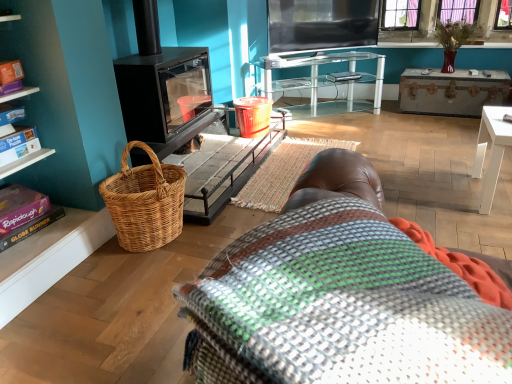
In order to face black matte fireplace at left, should I rotate leftwards or rightwards?

To face it directly, rotate left by 11.425 degrees.

This screenshot has width=512, height=384. I want to click on woven wicker basket at left, so click(x=145, y=201).

Measure the distance between multicolored woven blanket at center and camera.

multicolored woven blanket at center and camera are 7.89 feet apart from each other.

The image size is (512, 384). Identify the location of flat-screen tv at upper center. (321, 25).

In order to face flat-screen tv at upper center, should I rotate leftwards or rightwards?

Turn right approximately 8.965 degrees to face it.

Describe the element at coordinates (490, 151) in the screenshot. The width and height of the screenshot is (512, 384). I see `white glossy table at lower right, the 1th table when ordered from bottom to top` at that location.

Locate an element on the screen. rustic wooden trunk at upper right is located at coordinates (451, 92).

Locate an element on the screen. blanket located above the woven wicker basket at left (from the image's perspective) is located at coordinates (283, 172).

Can you tell me how much multicolored woven blanket at center and woven wicker basket at left differ in facing direction?

0.00218 degrees separate the facing orientations of multicolored woven blanket at center and woven wicker basket at left.

Is multicolored woven blanket at center closer to camera compared to woven wicker basket at left?

No, multicolored woven blanket at center is further to the viewer.

Is multicolored woven blanket at center facing away from woven wicker basket at left?

No, multicolored woven blanket at center's orientation is not away from woven wicker basket at left.

From the image's perspective, is purple matte book at lower left positioned above or below teal painted wood shelf at left?

Based on their image positions, purple matte book at lower left is located beneath teal painted wood shelf at left.

Which of these two, purple matte book at lower left or teal painted wood shelf at left, is thinner?

Thinner between the two is purple matte book at lower left.

Between purple matte book at lower left and teal painted wood shelf at left, which one has larger size?

teal painted wood shelf at left is bigger.

Considering the positions of objects purple matte book at lower left and teal painted wood shelf at left in the image provided, who is more to the left, purple matte book at lower left or teal painted wood shelf at left?

teal painted wood shelf at left.

Are purple matte book at lower left and white glossy table at lower right, arranged as the first table when viewed from the right, located far from each other?

That's right, there is a large distance between purple matte book at lower left and white glossy table at lower right, arranged as the first table when viewed from the right.

Is purple matte book at lower left completely or partially outside of white glossy table at lower right, which is the 2th table from top to bottom?

purple matte book at lower left is positioned outside white glossy table at lower right, which is the 2th table from top to bottom.

Which of these two, purple matte book at lower left or white glossy table at lower right, arranged as the first table when viewed from the right, is thinner?

With smaller width is purple matte book at lower left.

Would you say purple matte book at lower left is to the left or to the right of white glossy table at lower right, arranged as the first table when viewed from the right, in the picture?

In the image, purple matte book at lower left appears on the left side of white glossy table at lower right, arranged as the first table when viewed from the right.

Which object is positioned more to the right, white glossy table at lower right, which appears as the second table when viewed from the back, or black matte fireplace at left?

From the viewer's perspective, white glossy table at lower right, which appears as the second table when viewed from the back, appears more on the right side.

From the image's perspective, is white glossy table at lower right, the 1th table when ordered from bottom to top, above or below black matte fireplace at left?

From the image's perspective, white glossy table at lower right, the 1th table when ordered from bottom to top, appears below black matte fireplace at left.

Would you say white glossy table at lower right, which is the 2th table from top to bottom, is outside black matte fireplace at left?

Absolutely, white glossy table at lower right, which is the 2th table from top to bottom, is external to black matte fireplace at left.

Can you tell me how much white glossy table at lower right, the 1th table when ordered from bottom to top, and black matte fireplace at left differ in facing direction?

white glossy table at lower right, the 1th table when ordered from bottom to top, and black matte fireplace at left are facing 92 degrees away from each other.

From the image's perspective, is teal painted wood shelf at left above or below multicolored woven blanket at center?

teal painted wood shelf at left is above multicolored woven blanket at center.

Would you say teal painted wood shelf at left is inside or outside multicolored woven blanket at center?

teal painted wood shelf at left is not enclosed by multicolored woven blanket at center.

Considering the sizes of teal painted wood shelf at left and multicolored woven blanket at center in the image, is teal painted wood shelf at left wider or thinner than multicolored woven blanket at center?

teal painted wood shelf at left is wider than multicolored woven blanket at center.

At what (x,y) coordinates should I click in order to perform the action: click on cabinetry in front of the multicolored woven blanket at center. Please return your answer as a coordinate pair (x, y). Looking at the image, I should click on (63, 138).

Can you confirm if flat-screen tv at upper center is wider than multicolored woven blanket at center?

In fact, flat-screen tv at upper center might be narrower than multicolored woven blanket at center.

From the image's perspective, relative to multicolored woven blanket at center, is flat-screen tv at upper center above or below?

Based on their image positions, flat-screen tv at upper center is located above multicolored woven blanket at center.

The height and width of the screenshot is (384, 512). Find the location of `blanket below the flat-screen tv at upper center (from a real-world perspective)`. blanket below the flat-screen tv at upper center (from a real-world perspective) is located at coordinates (283, 172).

Is flat-screen tv at upper center inside or outside of multicolored woven blanket at center?

flat-screen tv at upper center is located beyond the bounds of multicolored woven blanket at center.

From the picture: Is woven wicker basket at left positioned in front of flat-screen tv at upper center?

Yes, it is in front of flat-screen tv at upper center.

Can you confirm if woven wicker basket at left is taller than flat-screen tv at upper center?

No, woven wicker basket at left is not taller than flat-screen tv at upper center.

Considering the positions of point (162, 189) and point (303, 51), is point (162, 189) closer or farther from the camera than point (303, 51)?

Point (162, 189) appears to be closer to the viewer than point (303, 51).

The image size is (512, 384). In the image, there is a multicolored woven blanket at center. Find the location of `picnic basket below it (from the image's perspective)`. picnic basket below it (from the image's perspective) is located at coordinates (145, 201).

Where is `cabinetry above the purple matte book at lower left (from the image's perspective)`? cabinetry above the purple matte book at lower left (from the image's perspective) is located at coordinates (63, 138).

When comparing their distances from black matte fireplace at left, does rustic wooden trunk at upper right or clear glass table at upper center, the 1th table viewed from the back, seem closer?

The object closer to black matte fireplace at left is clear glass table at upper center, the 1th table viewed from the back.

Which object lies nearer to the anchor point multicolored woven blanket at center, rustic wooden trunk at upper right or white glossy table at lower right, the second table from the left?

The object closer to multicolored woven blanket at center is white glossy table at lower right, the second table from the left.

Based on their spatial positions, is multicolored woven blanket at center or brown leather bean bag chair at lower center closer to rustic wooden trunk at upper right?

multicolored woven blanket at center is closer to rustic wooden trunk at upper right.

Considering their positions, is multicolored woven blanket at center positioned further to flat-screen tv at upper center than purple matte book at lower left?

Based on the image, purple matte book at lower left appears to be further to flat-screen tv at upper center.

Which object lies further to the anchor point rustic wooden trunk at upper right, brown leather bean bag chair at lower center or clear glass table at upper center, placed as the 2th table when sorted from bottom to top?

brown leather bean bag chair at lower center is further to rustic wooden trunk at upper right.

From the image, which object appears to be farther from rustic wooden trunk at upper right, brown leather bean bag chair at lower center or white glossy table at lower right, the 1th table viewed from the front?

Among the two, brown leather bean bag chair at lower center is located further to rustic wooden trunk at upper right.

Looking at the image, which one is located further to rustic wooden trunk at upper right, brown leather bean bag chair at lower center or multicolored woven blanket at center?

brown leather bean bag chair at lower center lies further to rustic wooden trunk at upper right than the other object.

Considering their positions, is brown leather bean bag chair at lower center positioned closer to teal painted wood shelf at left than black matte fireplace at left?

black matte fireplace at left is closer to teal painted wood shelf at left.

Where is `book between teal painted wood shelf at left and black matte fireplace at left from front to back`? This screenshot has width=512, height=384. book between teal painted wood shelf at left and black matte fireplace at left from front to back is located at coordinates (24, 214).

This screenshot has width=512, height=384. I want to click on cabinetry between brown leather bean bag chair at lower center and multicolored woven blanket at center along the z-axis, so click(63, 138).

The image size is (512, 384). Identify the location of fireplace between teal painted wood shelf at left and multicolored woven blanket at center in the horizontal direction. (189, 124).

Where is `blanket between purple matte book at lower left and white glossy table at lower right, the 1th table viewed from the front`? This screenshot has height=384, width=512. blanket between purple matte book at lower left and white glossy table at lower right, the 1th table viewed from the front is located at coordinates (283, 172).